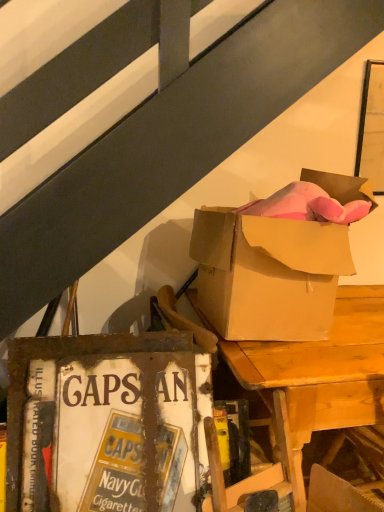
This screenshot has height=512, width=384. What do you see at coordinates (318, 378) in the screenshot? I see `wooden desk at upper right` at bounding box center [318, 378].

What do you see at coordinates (106, 423) in the screenshot? I see `rusty metal sign at lower left` at bounding box center [106, 423].

Find the location of `wooden desk at upper right`. wooden desk at upper right is located at coordinates (318, 378).

Which object is further away from the camera, matte cardboard box at upper right or wooden desk at upper right?

Positioned behind is wooden desk at upper right.

Is wooden desk at upper right completely or partially inside matte cardboard box at upper right?

Actually, wooden desk at upper right is outside matte cardboard box at upper right.

Which is closer, (x=227, y=276) or (x=78, y=498)?

Point (x=227, y=276) appears to be farther away from the viewer than point (x=78, y=498).

Are matte cardboard box at upper right and rusty metal sign at lower left beside each other?

No, matte cardboard box at upper right is not next to rusty metal sign at lower left.

Considering the positions of objects matte cardboard box at upper right and rusty metal sign at lower left in the image provided, who is more to the left, matte cardboard box at upper right or rusty metal sign at lower left?

rusty metal sign at lower left is more to the left.

From a real-world perspective, which object rests below the other?

From a 3D spatial view, rusty metal sign at lower left is below.

How many degrees apart are the facing directions of rusty metal sign at lower left and matte cardboard box at upper right?

rusty metal sign at lower left and matte cardboard box at upper right are facing 4.29 degrees away from each other.

Between rusty metal sign at lower left and matte cardboard box at upper right, which one appears on the left side from the viewer's perspective?

rusty metal sign at lower left.

Does rusty metal sign at lower left have a lesser width compared to matte cardboard box at upper right?

Indeed, rusty metal sign at lower left has a lesser width compared to matte cardboard box at upper right.

Is rusty metal sign at lower left next to matte cardboard box at upper right and touching it?

No, rusty metal sign at lower left is not making contact with matte cardboard box at upper right.

How distant is wooden desk at upper right from rusty metal sign at lower left?

wooden desk at upper right and rusty metal sign at lower left are 40.36 centimeters apart from each other.

Can you confirm if wooden desk at upper right is wider than rusty metal sign at lower left?

Indeed, wooden desk at upper right has a greater width compared to rusty metal sign at lower left.

From the image's perspective, is wooden desk at upper right on top of rusty metal sign at lower left?

Yes, from the image's perspective, wooden desk at upper right is on top of rusty metal sign at lower left.

Does wooden desk at upper right turn towards rusty metal sign at lower left?

No, wooden desk at upper right is not aimed at rusty metal sign at lower left.

In terms of height, does wooden desk at upper right look taller or shorter compared to matte cardboard box at upper right?

Clearly, wooden desk at upper right is taller compared to matte cardboard box at upper right.

Is wooden desk at upper right facing away from matte cardboard box at upper right?

That's not correct — wooden desk at upper right is not looking away from matte cardboard box at upper right.

How distant is wooden desk at upper right from matte cardboard box at upper right?

The distance of wooden desk at upper right from matte cardboard box at upper right is 9.64 inches.

How many degrees apart are the facing directions of wooden desk at upper right and matte cardboard box at upper right?

0.659 degrees separate the facing orientations of wooden desk at upper right and matte cardboard box at upper right.

Considering the sizes of rusty metal sign at lower left and wooden desk at upper right in the image, is rusty metal sign at lower left wider or thinner than wooden desk at upper right?

rusty metal sign at lower left is thinner than wooden desk at upper right.

Are rusty metal sign at lower left and wooden desk at upper right making contact?

rusty metal sign at lower left and wooden desk at upper right are not in contact.

From a real-world perspective, which is physically below, rusty metal sign at lower left or wooden desk at upper right?

wooden desk at upper right.

You are a GUI agent. You are given a task and a screenshot of the screen. Output one action in this format:
    pyautogui.click(x=<x>, y=<y>)
    Task: Click on the desk below the matte cardboard box at upper right (from a real-world perspective)
    The width and height of the screenshot is (384, 512).
    Given the screenshot: What is the action you would take?
    pyautogui.click(x=318, y=378)

Locate an element on the screen. paperback book on the left of matte cardboard box at upper right is located at coordinates (106, 423).

Considering their positions, is rusty metal sign at lower left positioned further to matte cardboard box at upper right than wooden desk at upper right?

rusty metal sign at lower left.

Based on their spatial positions, is matte cardboard box at upper right or rusty metal sign at lower left closer to wooden desk at upper right?

Based on the image, matte cardboard box at upper right appears to be nearer to wooden desk at upper right.

Considering their positions, is matte cardboard box at upper right positioned further to rusty metal sign at lower left than wooden desk at upper right?

matte cardboard box at upper right lies further to rusty metal sign at lower left than the other object.

When comparing their distances from matte cardboard box at upper right, does wooden desk at upper right or rusty metal sign at lower left seem closer?

wooden desk at upper right lies closer to matte cardboard box at upper right than the other object.

Based on their spatial positions, is wooden desk at upper right or matte cardboard box at upper right closer to rusty metal sign at lower left?

Among the two, wooden desk at upper right is located nearer to rusty metal sign at lower left.

Which object lies nearer to the anchor point wooden desk at upper right, rusty metal sign at lower left or matte cardboard box at upper right?

matte cardboard box at upper right.

This screenshot has height=512, width=384. I want to click on box located between rusty metal sign at lower left and wooden desk at upper right in the left-right direction, so click(268, 274).